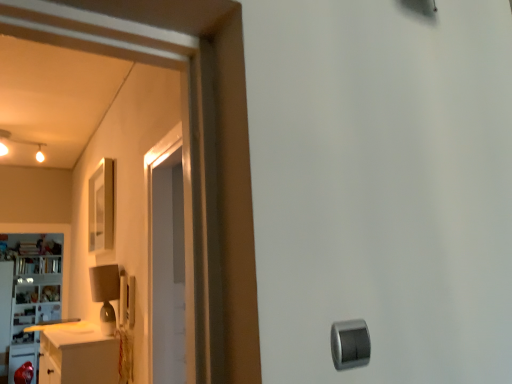
This screenshot has width=512, height=384. Describe the element at coordinates (350, 344) in the screenshot. I see `silver metallic knob at lower right` at that location.

Where is `silver metallic knob at lower right`? silver metallic knob at lower right is located at coordinates (350, 344).

In order to click on white glossy cabinet at left in this screenshot , I will do `click(28, 295)`.

What do you see at coordinates (28, 295) in the screenshot?
I see `white glossy cabinet at left` at bounding box center [28, 295].

Image resolution: width=512 pixels, height=384 pixels. In order to click on silver metallic knob at lower right in this screenshot , I will do `click(350, 344)`.

Can you confirm if silver metallic knob at lower right is positioned to the right of white glossy cabinet at left?

Correct, you'll find silver metallic knob at lower right to the right of white glossy cabinet at left.

Is silver metallic knob at lower right closer to camera compared to white glossy cabinet at left?

Yes, silver metallic knob at lower right is in front of white glossy cabinet at left.

Is point (347, 363) closer or farther from the camera than point (14, 339)?

Point (347, 363) is positioned closer to the camera compared to point (14, 339).

From the image's perspective, is silver metallic knob at lower right beneath white glossy cabinet at left?

Actually, silver metallic knob at lower right appears above white glossy cabinet at left in the image.

From a real-world perspective, is silver metallic knob at lower right physically below white glossy cabinet at left?

Yes.

Looking at their sizes, would you say silver metallic knob at lower right is wider or thinner than white glossy cabinet at left?

Considering their sizes, silver metallic knob at lower right looks slimmer than white glossy cabinet at left.

From their relative heights in the image, would you say silver metallic knob at lower right is taller or shorter than white glossy cabinet at left?

silver metallic knob at lower right is shorter than white glossy cabinet at left.

Is silver metallic knob at lower right bigger than white glossy cabinet at left?

No, silver metallic knob at lower right is not bigger than white glossy cabinet at left.

Would you say white glossy cabinet at left is part of silver metallic knob at lower right's contents?

No, white glossy cabinet at left is not a part of silver metallic knob at lower right.

Is the surface of silver metallic knob at lower right in direct contact with white glossy cabinet at left?

No, silver metallic knob at lower right is not next to white glossy cabinet at left.

Is silver metallic knob at lower right facing towards white glossy cabinet at left?

No, silver metallic knob at lower right is not turned towards white glossy cabinet at left.

Based on the photo, can you tell me how much silver metallic knob at lower right and white glossy cabinet at left differ in facing direction?

There is a 1.14-degree angle between the facing directions of silver metallic knob at lower right and white glossy cabinet at left.

Locate an element on the screen. The image size is (512, 384). knob in front of the white glossy cabinet at left is located at coordinates (350, 344).

Is white glossy cabinet at left to the left of silver metallic knob at lower right from the viewer's perspective?

Yes.

Who is more distant, white glossy cabinet at left or silver metallic knob at lower right?

white glossy cabinet at left is more distant.

Which is further, (24, 358) or (340, 353)?

The point (24, 358) is more distant.

From the image's perspective, which is above, white glossy cabinet at left or silver metallic knob at lower right?

silver metallic knob at lower right.

From a real-world perspective, is white glossy cabinet at left located beneath silver metallic knob at lower right?

Incorrect, from a real-world perspective, white glossy cabinet at left is higher than silver metallic knob at lower right.

In terms of width, does white glossy cabinet at left look wider or thinner when compared to silver metallic knob at lower right?

Considering their sizes, white glossy cabinet at left looks broader than silver metallic knob at lower right.

From their relative heights in the image, would you say white glossy cabinet at left is taller or shorter than silver metallic knob at lower right?

Considering their sizes, white glossy cabinet at left has more height than silver metallic knob at lower right.

Is white glossy cabinet at left smaller than silver metallic knob at lower right?

No.

Is white glossy cabinet at left spatially inside silver metallic knob at lower right, or outside of it?

white glossy cabinet at left is not enclosed by silver metallic knob at lower right.

Is white glossy cabinet at left placed right next to silver metallic knob at lower right?

white glossy cabinet at left and silver metallic knob at lower right are clearly separated.

Is white glossy cabinet at left positioned with its back to silver metallic knob at lower right?

That's not correct — white glossy cabinet at left is not looking away from silver metallic knob at lower right.

This screenshot has width=512, height=384. I want to click on cabinetry positioned vertically above the silver metallic knob at lower right (from a real-world perspective), so click(28, 295).

Locate an element on the screen. The image size is (512, 384). knob to the right of white glossy cabinet at left is located at coordinates (350, 344).

Find the location of a particular element. Image resolution: width=512 pixels, height=384 pixels. cabinetry above the silver metallic knob at lower right (from a real-world perspective) is located at coordinates (28, 295).